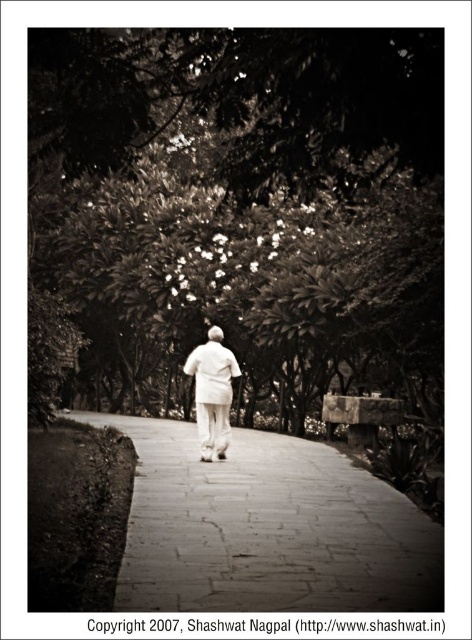
Question: Which point appears closest to the camera in this image?

Choices:
 (A) (292, 529)
 (B) (353, 378)
 (C) (202, 362)

Answer: (A)

Question: Does green leafy tree at center have a smaller size compared to paved stone path at center?

Choices:
 (A) no
 (B) yes

Answer: (A)

Question: Which object appears farthest from the camera in this image?

Choices:
 (A) green leafy tree at center
 (B) paved stone path at center
 (C) white matte coat at center

Answer: (C)

Question: Is paved stone path at center above white matte coat at center?

Choices:
 (A) no
 (B) yes

Answer: (A)

Question: Does green leafy tree at center appear on the left side of white matte coat at center?

Choices:
 (A) yes
 (B) no

Answer: (A)

Question: Considering the real-world distances, which object is closest to the paved stone path at center?

Choices:
 (A) white matte coat at center
 (B) green leafy tree at center

Answer: (A)